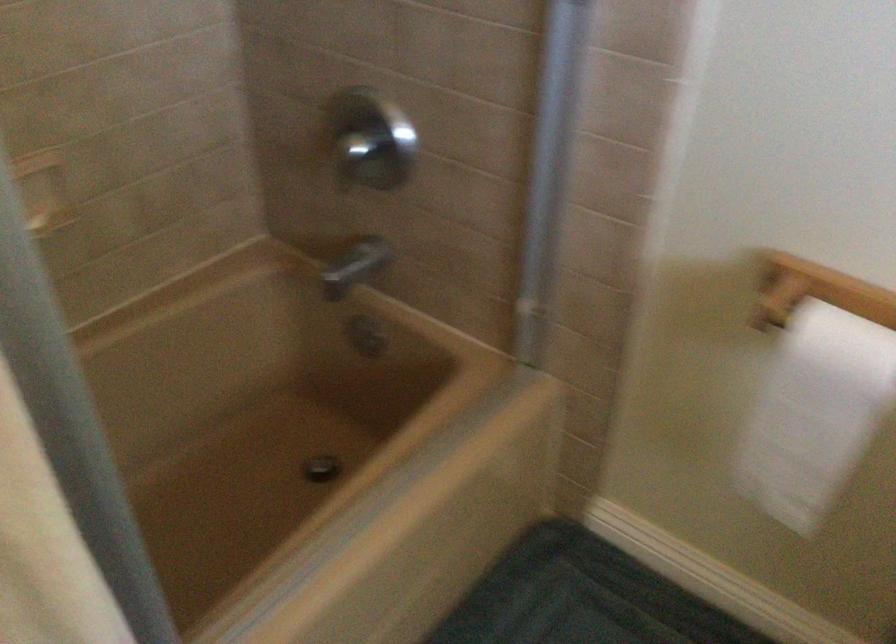
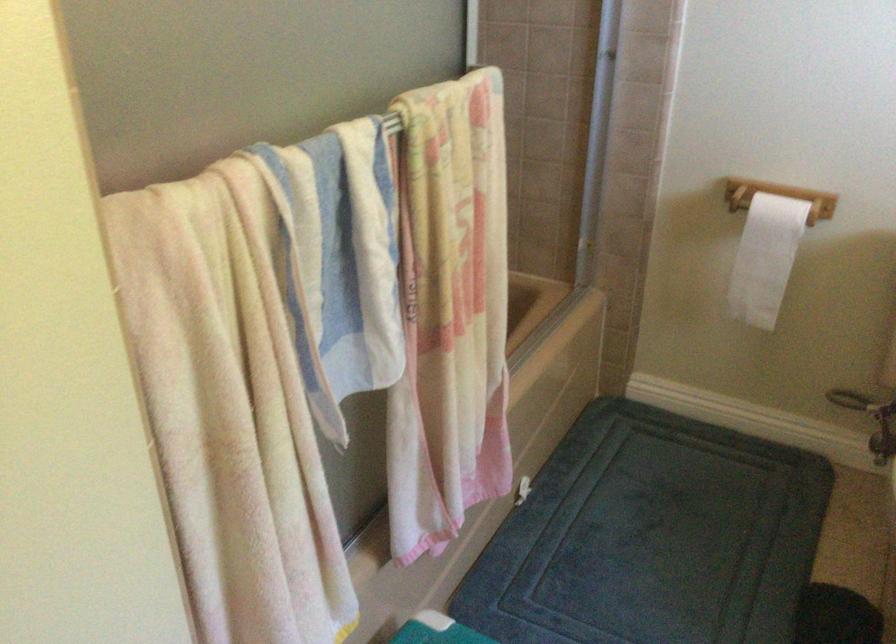
In the second image, find the point that corresponds to point 807,428 in the first image.

(764, 258)